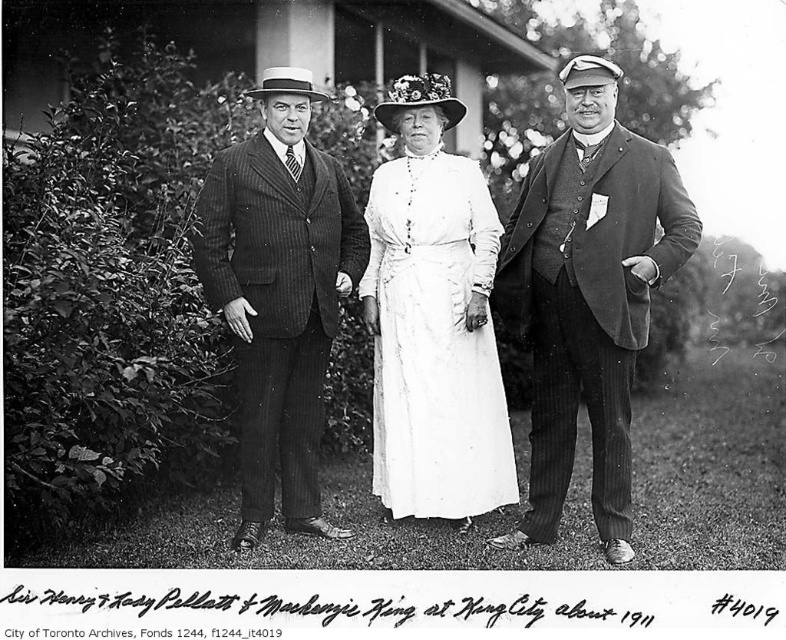
Question: Is pinstriped suit at center thinner than white cotton dress at center?

Choices:
 (A) no
 (B) yes

Answer: (B)

Question: Among these objects, which one is farthest from the camera?

Choices:
 (A) matte black suit at center
 (B) pinstriped suit at center
 (C) white cotton dress at center

Answer: (C)

Question: Which point is farther from the camera taking this photo?

Choices:
 (A) (516, 218)
 (B) (483, 410)
 (C) (546, 180)
 (D) (296, 106)

Answer: (A)

Question: Which object is the closest to the matte black suit at center?

Choices:
 (A) white cotton dress at center
 (B) smooth dark suit at center

Answer: (A)

Question: Is the position of smooth dark suit at center less distant than that of pinstriped suit at center?

Choices:
 (A) no
 (B) yes

Answer: (B)

Question: Is the position of pinstriped suit at center less distant than that of white cotton dress at center?

Choices:
 (A) no
 (B) yes

Answer: (B)